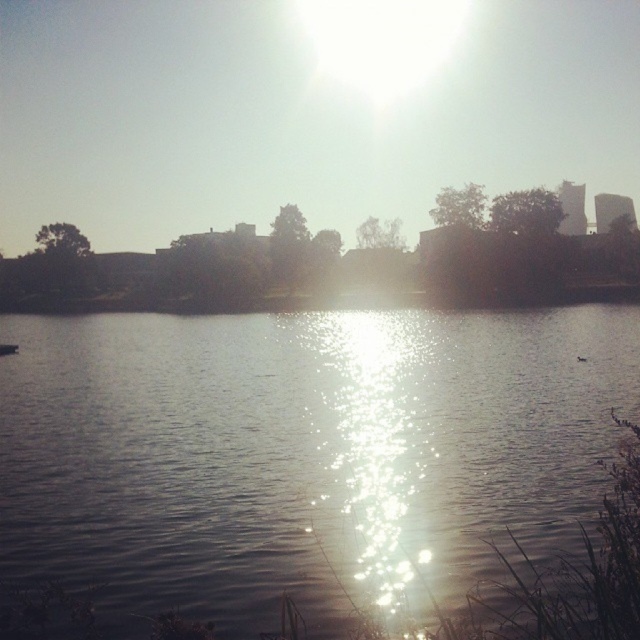
You are a photographer trying to capture the reflection of the sun in the water. You notice two areas of water that might work well. The first is the silvery reflective water at center, and the second is the sparkling water at center. Which one do you think would better reflect the sun given their positions?

The silvery reflective water at center is positioned on the left side of sparkling water at center, so it would better reflect the sun since it is closer to the direction of the sunlight coming from the upper right.

You are standing at the edge of the lake and want to find the silvery reflective water at center. According to the coordinates provided, where exactly should you look in relation to your position?

The silvery reflective water at center is located at coordinates point (300, 452), which means it is positioned approximately 70.8 percent to the right and 47 percent down from the top left corner of the scene.

You are standing at the lakeside and see two points in the image. One is at point coordinates point (116, 602) and the other is at point (378, 358). Which point is closer to you?

Point (116, 602) is closer to the camera than point (378, 358).